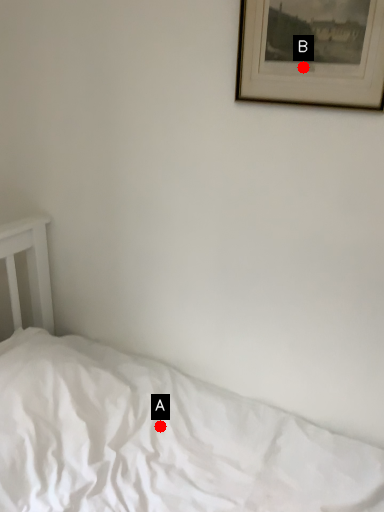
Question: Two points are circled on the image, labeled by A and B beside each circle. Which of the following is the closest to the observer?

Choices:
 (A) A is closer
 (B) B is closer

Answer: (B)